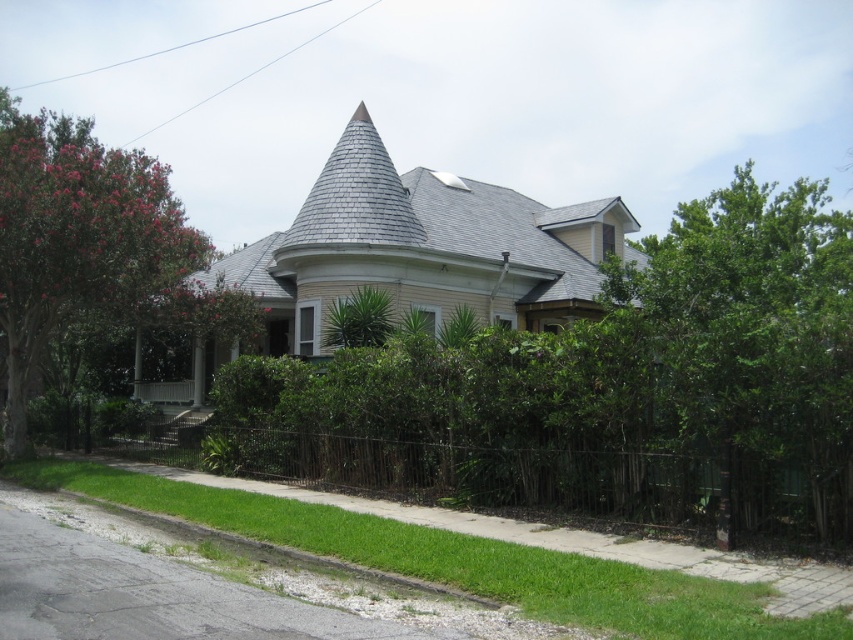
Does point (666, 326) come behind point (796, 182)?

No, (666, 326) is in front of (796, 182).

Does point (759, 385) come farther from viewer compared to point (798, 385)?

That is True.

Image resolution: width=853 pixels, height=640 pixels. Identify the location of green leafy bush at center. (618, 381).

Can you confirm if green leafy bush at center is positioned above green leafy tree at left?

No, green leafy bush at center is not above green leafy tree at left.

Measure the distance between point (273, 413) and camera.

Point (273, 413) is 14.69 meters away from camera.

Locate an element on the screen. green leafy bush at center is located at coordinates (618, 381).

Identify the location of green leafy bush at center. click(x=618, y=381).

Which is above, black wrought iron fence at lower center or green leafy tree at left?

green leafy tree at left is above.

Is point (752, 480) positioned behind point (65, 228)?

No, (752, 480) is in front of (65, 228).

Between point (444, 486) and point (9, 390), which one is positioned behind?

Point (9, 390)

The height and width of the screenshot is (640, 853). I want to click on black wrought iron fence at lower center, so click(x=532, y=483).